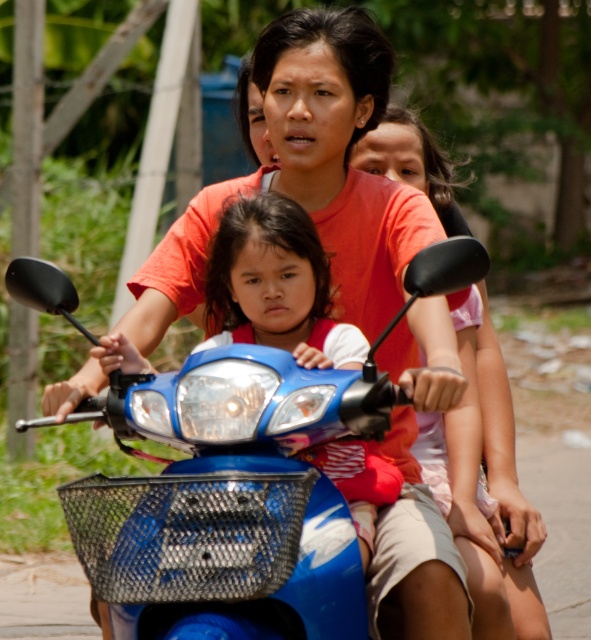
Question: Does pink fabric shirt at center have a lesser width compared to matte blue scooter at center?

Choices:
 (A) no
 (B) yes

Answer: (B)

Question: Which object is positioned farthest from the blue glossy motorcycle at center?

Choices:
 (A) pink fabric shirt at center
 (B) matte blue scooter at center

Answer: (A)

Question: Which of these objects is positioned farthest from the matte blue scooter at center?

Choices:
 (A) blue glossy motorcycle at center
 (B) pink fabric shirt at center

Answer: (B)

Question: Can you confirm if pink fabric shirt at center is bigger than matte blue scooter at center?

Choices:
 (A) yes
 (B) no

Answer: (B)

Question: Does pink fabric shirt at center have a lesser width compared to matte blue scooter at center?

Choices:
 (A) no
 (B) yes

Answer: (B)

Question: Which of the following is the farthest from the observer?

Choices:
 (A) (483, 579)
 (B) (394, 403)

Answer: (A)